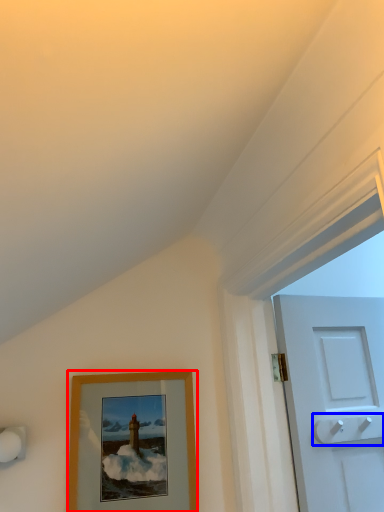
Question: Which of the following is the farthest to the observer, picture frame (highlighted by a red box) or door handle (highlighted by a blue box)?

Choices:
 (A) picture frame
 (B) door handle

Answer: (B)